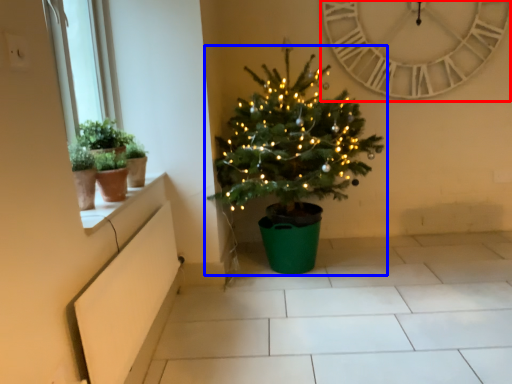
Question: Which object is closer to the camera taking this photo, clock (highlighted by a red box) or christmas tree (highlighted by a blue box)?

Choices:
 (A) clock
 (B) christmas tree

Answer: (B)